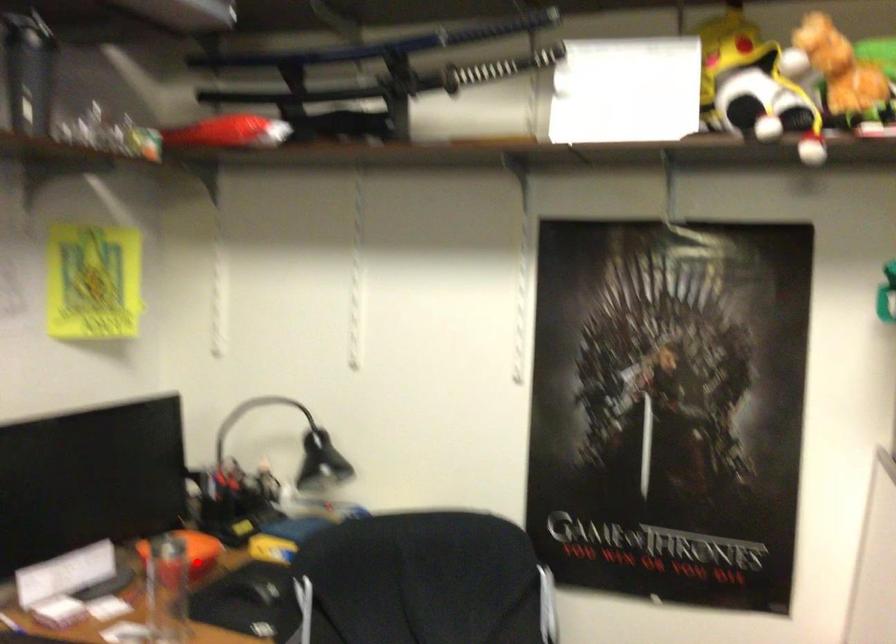
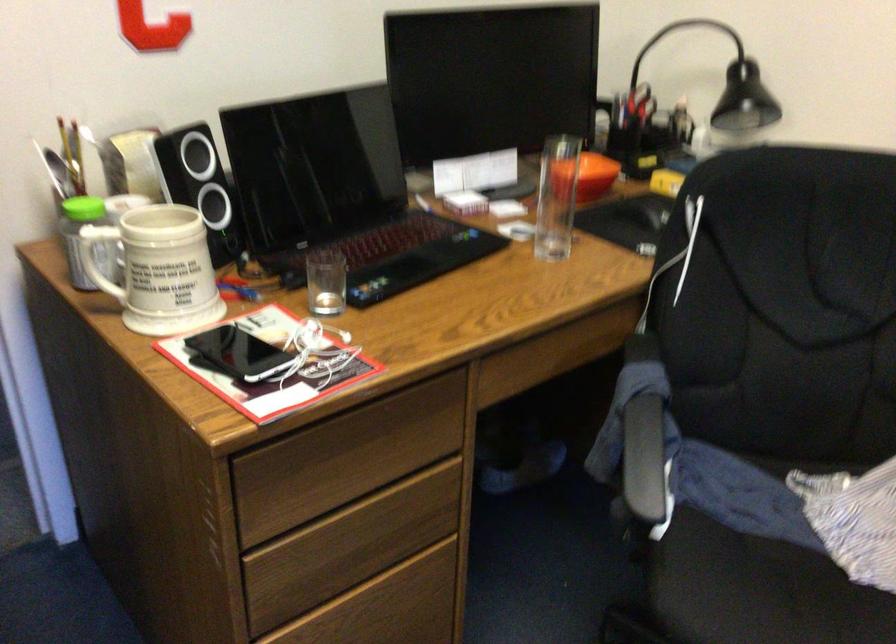
In the second image, find the point that corresponds to the highlighted location in the first image.

(590, 176)